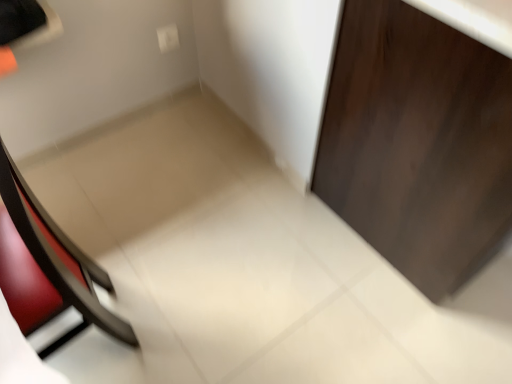
Question: Which is correct: white plastic electric outlet at upper center is inside dark wood door at right, or outside of it?

Choices:
 (A) inside
 (B) outside

Answer: (B)

Question: Considering the positions of white plastic electric outlet at upper center and dark wood door at right in the image, is white plastic electric outlet at upper center taller or shorter than dark wood door at right?

Choices:
 (A) tall
 (B) short

Answer: (B)

Question: Estimate the real-world distances between objects in this image. Which object is farther from the matte black chair at left?

Choices:
 (A) dark wood door at right
 (B) white plastic electric outlet at upper center

Answer: (B)

Question: Which is farther from the matte black chair at left?

Choices:
 (A) dark wood door at right
 (B) white plastic electric outlet at upper center

Answer: (B)